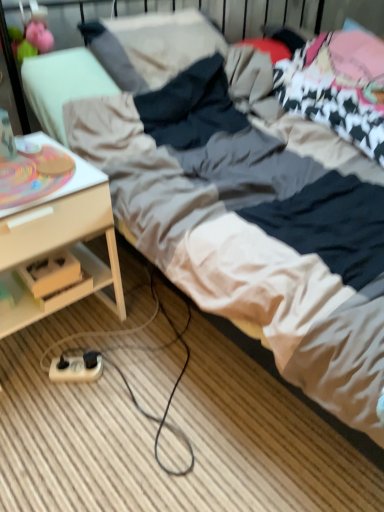
Locate an element on the screen. The image size is (384, 512). unoccupied area in front of white wood desk at lower left is located at coordinates (65, 430).